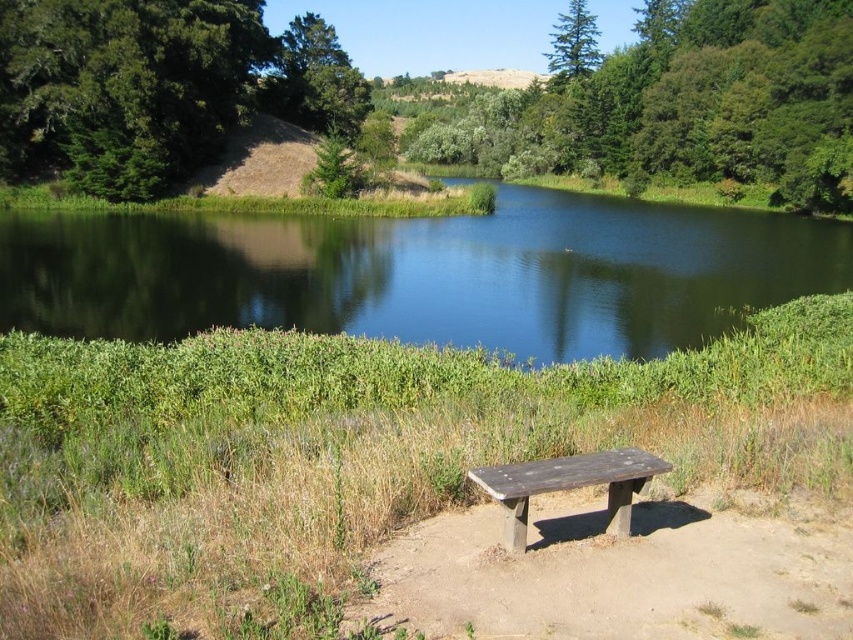
Which is below, green smooth water at center or green leafy tree at upper center?

Positioned lower is green smooth water at center.

Between green smooth water at center and green leafy tree at upper center, which one has less height?

Standing shorter between the two is green smooth water at center.

Which is behind, point (86, 301) or point (618, 83)?

Positioned behind is point (618, 83).

Where is `green smooth water at center`? The height and width of the screenshot is (640, 853). green smooth water at center is located at coordinates (422, 273).

Is green leafy tree at upper center positioned before wooden bench at center?

No, green leafy tree at upper center is further to the viewer.

Which is in front, point (657, 163) or point (509, 531)?

Point (509, 531)

Locate an element on the screen. This screenshot has width=853, height=640. green leafy tree at upper center is located at coordinates (666, 106).

Is wooden bench at center above green matte tree at upper center?

Incorrect, wooden bench at center is not positioned above green matte tree at upper center.

Based on the photo, is wooden bench at center positioned before green matte tree at upper center?

That is True.

Does point (666, 467) come farther from viewer compared to point (560, 51)?

That is False.

Where is `wooden bench at center`? This screenshot has height=640, width=853. wooden bench at center is located at coordinates (567, 484).